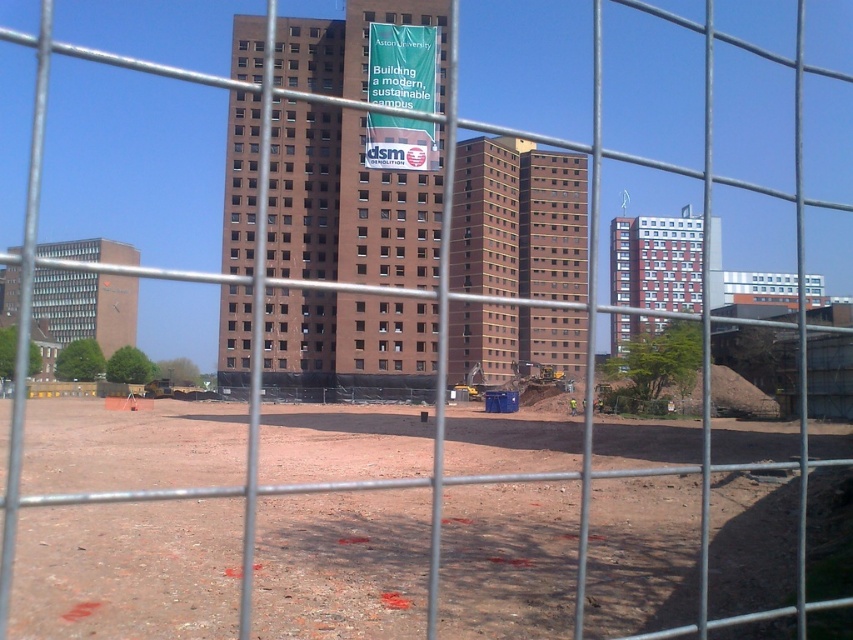
You are standing at the point marked by the coordinates point (126, 570) in the image. Based on the scene described, what type of terrain are you currently standing on?

You are standing on the brown dirt field at center, which is represented by the coordinates point (126, 570).

You are a construction worker who needs to place a new safety sign between the brown dirt field at center and the green fabric banner at center. According to the scene description, which object should you place the sign closer to?

The brown dirt field at center is to the right of the green fabric banner at center, so you should place the sign closer to the green fabric banner at center to be between them.

You are standing at the center of the construction site and see two points marked on the ground. The first point is at location point (x=344, y=461) and the second is at point (x=386, y=166). Which point is closer to you?

Point (x=344, y=461) is in front of point (x=386, y=166), so the first point is closer to you.